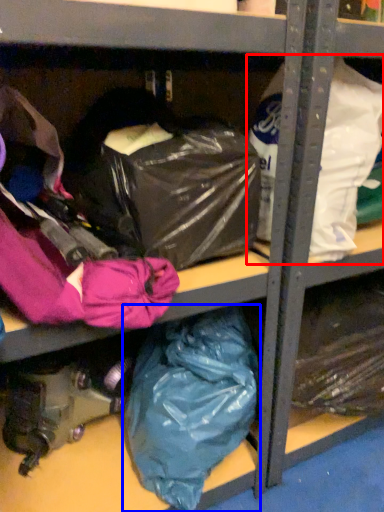
Question: Which of the following is the farthest to the observer, plastic bag (highlighted by a red box) or plastic bag (highlighted by a blue box)?

Choices:
 (A) plastic bag
 (B) plastic bag

Answer: (B)